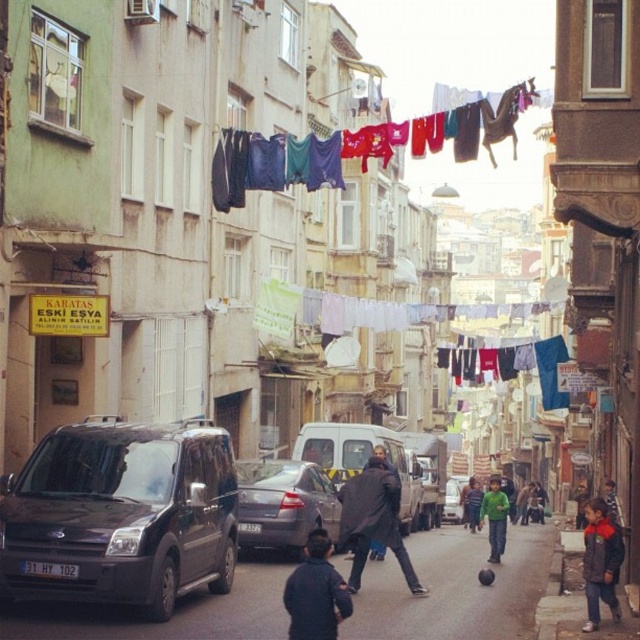
Based on the photo, you are standing on the street looking at the clotheslines. There are two points marked on the clothesline, one at point coordinates point (40, 493) and the other at point coordinates point (608, 538). Which point is closer to you?

Point (40, 493) is closer to the camera than point (608, 538).

You are a delivery driver approaching the street with a matte black van at left and a green cotton sweater at center. Which object is positioned to the left side of the other?

The matte black van at left is positioned to the left of the green cotton sweater at center.